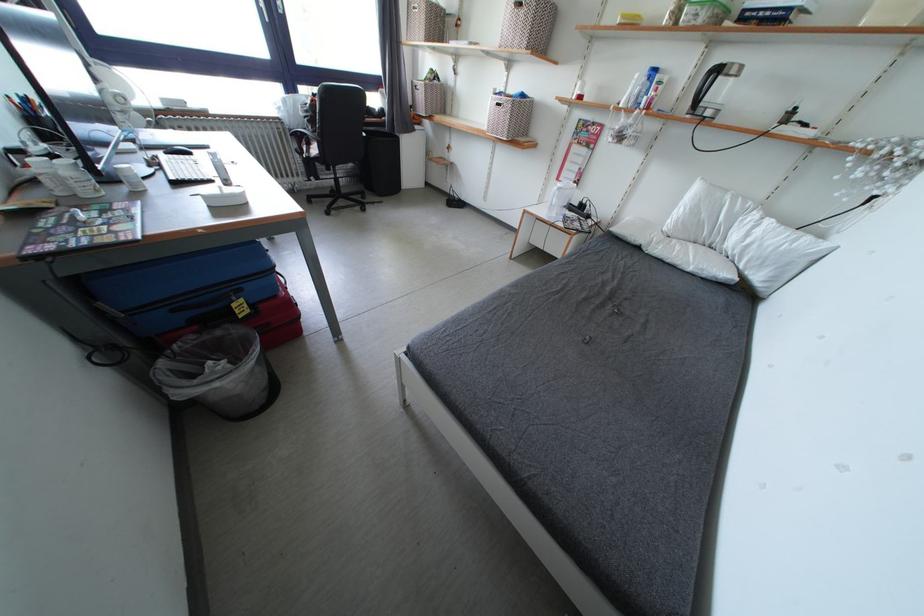
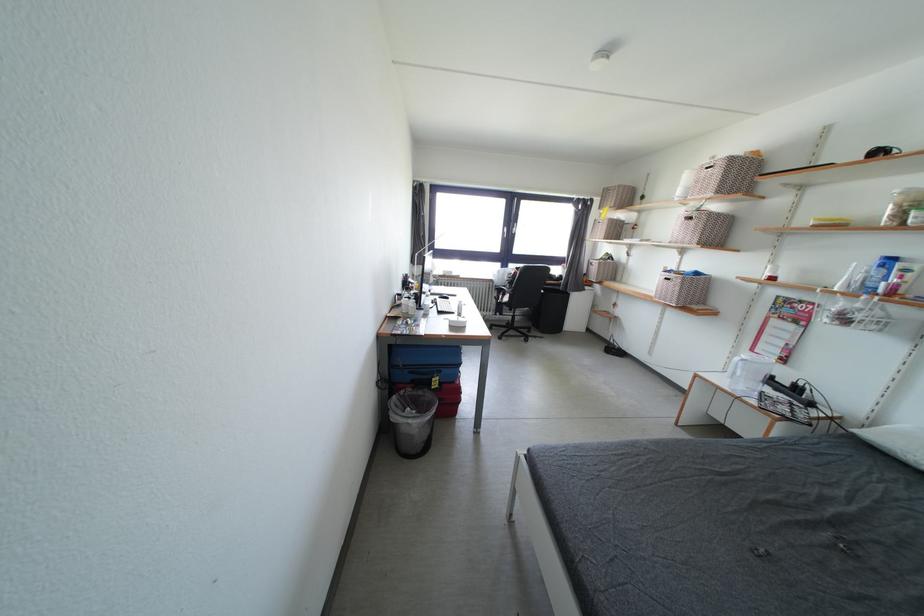
Where in the second image is the point corresponding to point 302,95 from the first image?

(514, 270)